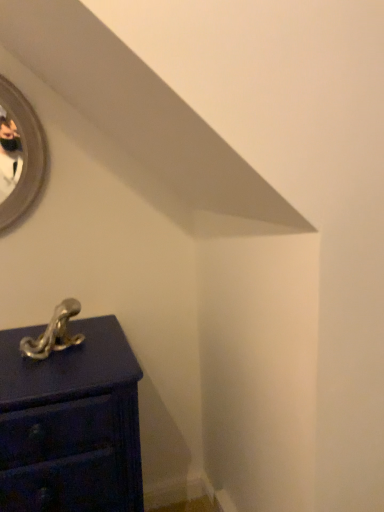
Identify the location of blank space situated above matte dark blue chest of drawers at lower left (from a real-world perspective). The width and height of the screenshot is (384, 512). (54, 355).